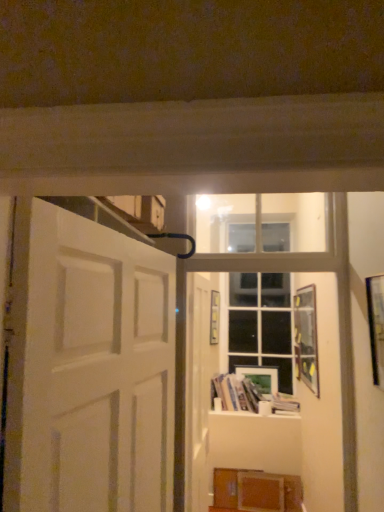
Question: From a real-world perspective, is white matte door at center, acting as the 1th door starting from the right, positioned over wooden picture frame at center, positioned as the 1th picture frame in left-to-right order, based on gravity?

Choices:
 (A) no
 (B) yes

Answer: (A)

Question: From the image's perspective, is white matte door at center, acting as the 1th door starting from the right, on top of wooden picture frame at center, positioned as the 1th picture frame in left-to-right order?

Choices:
 (A) yes
 (B) no

Answer: (B)

Question: Is white matte door at center, arranged as the 2th door when viewed from the left, turned away from wooden picture frame at center, acting as the 2th picture frame starting from the back?

Choices:
 (A) no
 (B) yes

Answer: (A)

Question: Considering the relative positions of white matte door at center, positioned as the 2th door in front-to-back order, and wooden picture frame at center, acting as the 2th picture frame starting from the back, in the image provided, is white matte door at center, positioned as the 2th door in front-to-back order, to the left of wooden picture frame at center, acting as the 2th picture frame starting from the back, from the viewer's perspective?

Choices:
 (A) no
 (B) yes

Answer: (B)

Question: Is white matte door at center, arranged as the 2th door when viewed from the left, further to camera compared to wooden picture frame at center, which ranks as the third picture frame in front-to-back order?

Choices:
 (A) no
 (B) yes

Answer: (A)

Question: From the image's perspective, is white matte door at center, positioned as the 2th door in front-to-back order, located beneath wooden picture frame at center, acting as the 2th picture frame starting from the back?

Choices:
 (A) yes
 (B) no

Answer: (A)

Question: Is wooden picture frame at center, which is the fourth picture frame from right to left, further to camera compared to white glossy bookshelf at lower center?

Choices:
 (A) yes
 (B) no

Answer: (A)

Question: Could you tell me if wooden picture frame at center, which ranks as the third picture frame in front-to-back order, is facing white glossy bookshelf at lower center?

Choices:
 (A) yes
 (B) no

Answer: (B)

Question: From the image's perspective, is wooden picture frame at center, acting as the 2th picture frame starting from the back, under white glossy bookshelf at lower center?

Choices:
 (A) yes
 (B) no

Answer: (B)

Question: Is wooden picture frame at center, acting as the 2th picture frame starting from the back, outside of white glossy bookshelf at lower center?

Choices:
 (A) yes
 (B) no

Answer: (A)

Question: Does wooden picture frame at center, positioned as the 1th picture frame in left-to-right order, appear on the right side of white glossy bookshelf at lower center?

Choices:
 (A) no
 (B) yes

Answer: (A)

Question: Does wooden picture frame at center, which is the fourth picture frame from right to left, have a lesser width compared to white glossy bookshelf at lower center?

Choices:
 (A) yes
 (B) no

Answer: (A)

Question: Could white glossy bookshelf at lower center be considered to be inside white matte door at center, acting as the 1th door starting from the right?

Choices:
 (A) no
 (B) yes

Answer: (A)